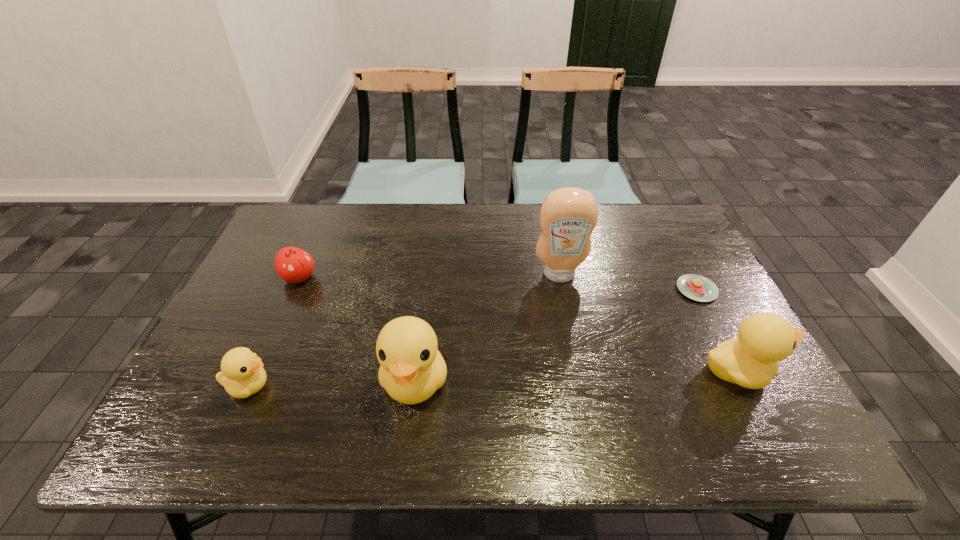
Where is `free space at the left edge of the desktop`? The width and height of the screenshot is (960, 540). free space at the left edge of the desktop is located at coordinates (245, 323).

The height and width of the screenshot is (540, 960). In order to click on vacant space at the far left corner of the desktop in this screenshot , I will do `click(294, 223)`.

You are a GUI agent. You are given a task and a screenshot of the screen. Output one action in this format:
    pyautogui.click(x=<x>, y=<y>)
    Task: Click on the vacant space at the near left corner of the desktop
    This screenshot has width=960, height=540.
    Given the screenshot: What is the action you would take?
    pyautogui.click(x=219, y=383)

Find the location of a particular element. This screenshot has height=540, width=960. free space between the condiment and the rightmost duck is located at coordinates (649, 323).

Where is `blank region between the rightmost duck and the leftmost duck`? Image resolution: width=960 pixels, height=540 pixels. blank region between the rightmost duck and the leftmost duck is located at coordinates (493, 379).

In order to click on empty location between the apple and the condiment in this screenshot , I will do `click(429, 276)`.

The height and width of the screenshot is (540, 960). What are the coordinates of `empty location between the shortest duck and the apple` in the screenshot? It's located at (275, 332).

The image size is (960, 540). I want to click on unoccupied area between the shortest object and the leftmost duck, so click(x=472, y=338).

At what (x,y) coordinates should I click in order to perform the action: click on vacant area that lies between the apple and the shortest duck. Please return your answer as a coordinate pair (x, y). This screenshot has width=960, height=540. Looking at the image, I should click on 275,332.

Where is `vacant area between the fourth object from left to right and the pastry`? vacant area between the fourth object from left to right and the pastry is located at coordinates (628, 282).